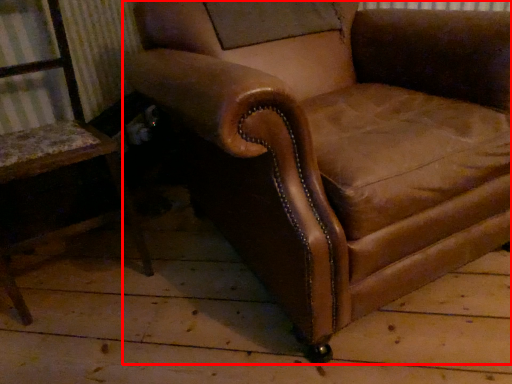
Question: Observing the image, what is the correct spatial positioning of chair (annotated by the red box) in reference to chair?

Choices:
 (A) left
 (B) right

Answer: (B)